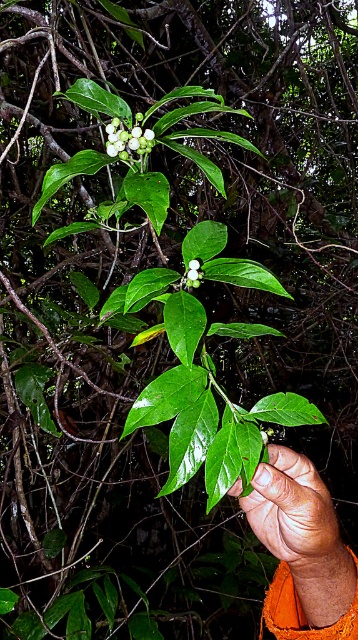
Question: Among these points, which one is nearest to the camera?

Choices:
 (A) (308, 566)
 (B) (196, 262)

Answer: (B)

Question: Observing the image, what is the correct spatial positioning of brown skin at center in reference to white matte flower at center?

Choices:
 (A) above
 (B) below

Answer: (B)

Question: Which of the following is the closest to the observer?

Choices:
 (A) (301, 541)
 (B) (123, 148)

Answer: (B)

Question: Based on their relative distances, which object is nearer to the brown skin at center?

Choices:
 (A) white matte berries at upper center
 (B) white matte flower at center

Answer: (B)

Question: Is brown skin at center positioned before white matte flower at center?

Choices:
 (A) yes
 (B) no

Answer: (B)

Question: Observing the image, what is the correct spatial positioning of brown skin at center in reference to white matte berries at upper center?

Choices:
 (A) below
 (B) above

Answer: (A)